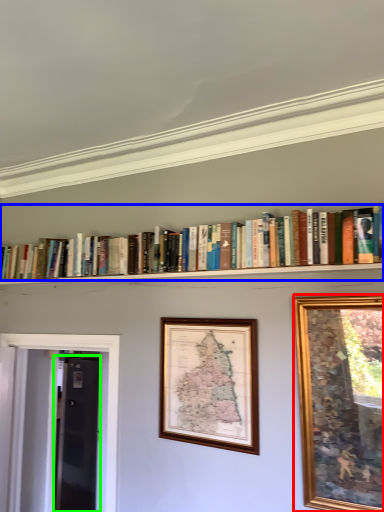
Question: Considering the real-world distances, which object is closest to picture frame (highlighted by a red box)? book (highlighted by a blue box) or glass door (highlighted by a green box).

Choices:
 (A) book
 (B) glass door

Answer: (A)